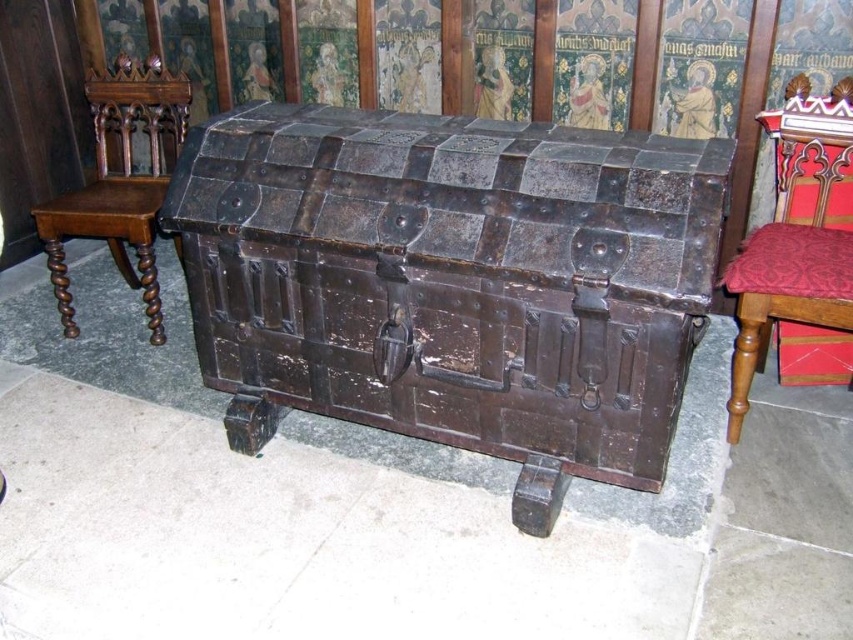
Question: Considering the real-world distances, which object is closest to the velvet red cushion at right?

Choices:
 (A) polished wood chair at left
 (B) rusty metal chest at center

Answer: (B)

Question: Considering the real-world distances, which object is farthest from the polished wood chair at left?

Choices:
 (A) velvet red cushion at right
 (B) rusty metal chest at center

Answer: (A)

Question: Which point is farther to the camera?

Choices:
 (A) polished wood chair at left
 (B) rusty metal chest at center

Answer: (A)

Question: Can you confirm if velvet red cushion at right is positioned to the left of polished wood chair at left?

Choices:
 (A) yes
 (B) no

Answer: (B)

Question: Can you confirm if velvet red cushion at right is positioned below polished wood chair at left?

Choices:
 (A) no
 (B) yes

Answer: (B)

Question: Can you confirm if velvet red cushion at right is positioned below polished wood chair at left?

Choices:
 (A) yes
 (B) no

Answer: (A)